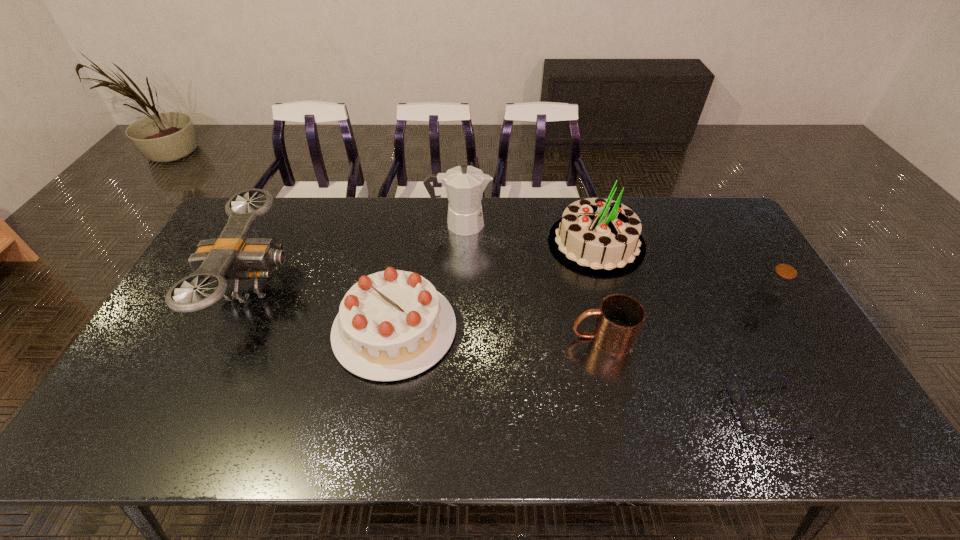
Locate an element on the screen. This screenshot has width=960, height=540. free space between the sixth object from left to right and the mug is located at coordinates (685, 374).

You are a GUI agent. You are given a task and a screenshot of the screen. Output one action in this format:
    pyautogui.click(x=<x>, y=<y>)
    Task: Click on the vacant region between the mug and the jar
    The image size is (960, 540).
    Given the screenshot: What is the action you would take?
    pyautogui.click(x=684, y=319)

At what (x,y) coordinates should I click in order to perform the action: click on free space between the second object from right to left and the drone. Please return your answer as a coordinate pair (x, y). The height and width of the screenshot is (540, 960). Looking at the image, I should click on (512, 347).

At what (x,y) coordinates should I click in order to perform the action: click on empty space between the right birthday cake and the nearer birthday cake. Please return your answer as a coordinate pair (x, y). The width and height of the screenshot is (960, 540). Looking at the image, I should click on (495, 286).

Select which object appears as the closest to the mug. Please provide its 2D coordinates. Your answer should be formatted as a tuple, i.e. [(x, y)], where the tuple contains the x and y coordinates of a point satisfying the conditions above.

[(599, 237)]

Find the location of a particular element. The width and height of the screenshot is (960, 540). object that is the fifth closest to the farther birthday cake is located at coordinates (748, 419).

This screenshot has height=540, width=960. I want to click on free location that satisfies the following two spatial constraints: 1. on the front side of the right birthday cake; 2. on the front-facing side of the drone, so click(608, 285).

Find the location of `vacant position in the image that satisfies the following two spatial constraints: 1. at the spout of the coffeepot; 2. on the left side of the taller birthday cake`. vacant position in the image that satisfies the following two spatial constraints: 1. at the spout of the coffeepot; 2. on the left side of the taller birthday cake is located at coordinates (459, 243).

This screenshot has height=540, width=960. I want to click on vacant position in the image that satisfies the following two spatial constraints: 1. at the spout of the right birthday cake; 2. on the right side of the coffeepot, so click(x=459, y=243).